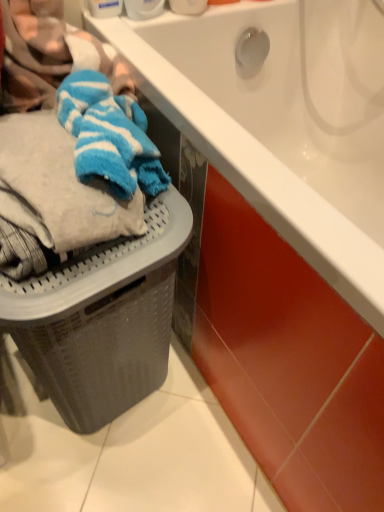
Question: Does gray textured laundry basket at lower left have a smaller size compared to blue striped towel at left?

Choices:
 (A) no
 (B) yes

Answer: (A)

Question: Is gray textured laundry basket at lower left facing away from blue striped towel at left?

Choices:
 (A) no
 (B) yes

Answer: (A)

Question: Is there a large distance between gray textured laundry basket at lower left and blue striped towel at left?

Choices:
 (A) no
 (B) yes

Answer: (A)

Question: From a real-world perspective, is gray textured laundry basket at lower left located beneath blue striped towel at left?

Choices:
 (A) yes
 (B) no

Answer: (A)

Question: Considering the relative positions of gray textured laundry basket at lower left and blue striped towel at left in the image provided, is gray textured laundry basket at lower left behind blue striped towel at left?

Choices:
 (A) no
 (B) yes

Answer: (B)

Question: Is white glossy bathtub at upper center bigger or smaller than gray textured laundry basket at lower left?

Choices:
 (A) small
 (B) big

Answer: (B)

Question: In the image, is white glossy bathtub at upper center positioned in front of or behind gray textured laundry basket at lower left?

Choices:
 (A) front
 (B) behind

Answer: (A)

Question: Is point (225, 68) positioned closer to the camera than point (150, 202)?

Choices:
 (A) farther
 (B) closer

Answer: (A)

Question: Considering the positions of white glossy bathtub at upper center and gray textured laundry basket at lower left in the image, is white glossy bathtub at upper center wider or thinner than gray textured laundry basket at lower left?

Choices:
 (A) thin
 (B) wide

Answer: (B)

Question: In the image, is white plastic container at upper center, which ranks as the 1th toiletry in right-to-left order, on the left side or the right side of blue striped towel at left?

Choices:
 (A) left
 (B) right

Answer: (B)

Question: Looking at their shapes, would you say white plastic container at upper center, which ranks as the 1th toiletry in right-to-left order, is wider or thinner than blue striped towel at left?

Choices:
 (A) thin
 (B) wide

Answer: (A)

Question: Based on their sizes in the image, would you say white plastic container at upper center, which is counted as the 2th toiletry, starting from the left, is bigger or smaller than blue striped towel at left?

Choices:
 (A) big
 (B) small

Answer: (B)

Question: Considering the positions of point (190, 8) and point (23, 89), is point (190, 8) closer or farther from the camera than point (23, 89)?

Choices:
 (A) closer
 (B) farther

Answer: (B)

Question: Is gray textured laundry basket at lower left wider or thinner than white plastic container at upper center, the 1th toiletry when ordered from left to right?

Choices:
 (A) wide
 (B) thin

Answer: (A)

Question: Would you say gray textured laundry basket at lower left is to the left or to the right of white plastic container at upper center, arranged as the 2th toiletry when viewed from the right, in the picture?

Choices:
 (A) right
 (B) left

Answer: (B)